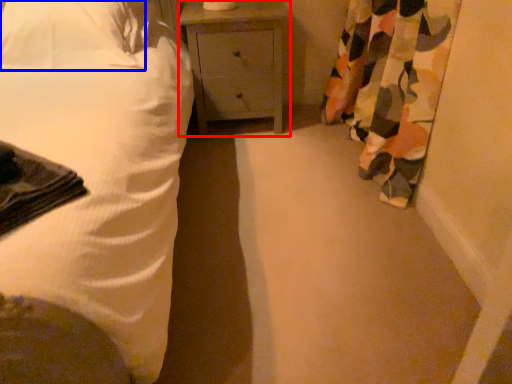
Question: Which point is further to the camera, nightstand (highlighted by a red box) or pillow (highlighted by a blue box)?

Choices:
 (A) nightstand
 (B) pillow

Answer: (A)